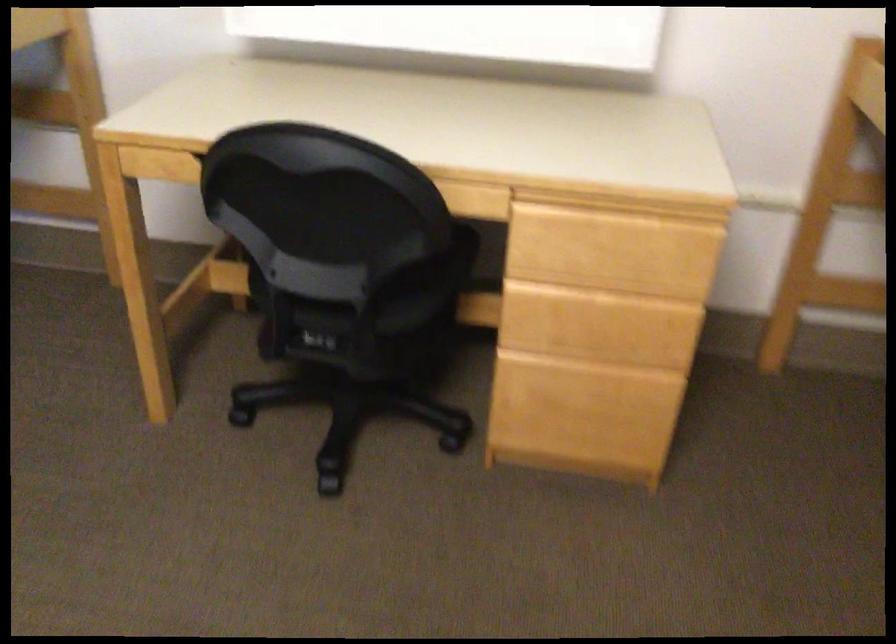
Question: The first image is from the beginning of the video and the second image is from the end. How did the camera likely rotate when shooting the video?

Choices:
 (A) Left
 (B) Right
 (C) Up
 (D) Down

Answer: (A)